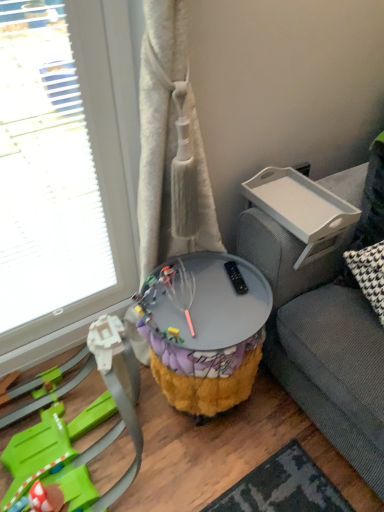
Question: Considering the relative sizes of white plastic tray at upper right, the second table ordered from the bottom, and fuzzy fabric side table at center, which is the first table from bottom to top, in the image provided, is white plastic tray at upper right, the second table ordered from the bottom, bigger than fuzzy fabric side table at center, which is the first table from bottom to top,?

Choices:
 (A) yes
 (B) no

Answer: (B)

Question: From a real-world perspective, is white plastic tray at upper right, arranged as the first table when viewed from the top, beneath fuzzy fabric side table at center, which is the first table from bottom to top?

Choices:
 (A) yes
 (B) no

Answer: (B)

Question: Is white plastic tray at upper right, arranged as the first table when viewed from the top, wider than fuzzy fabric side table at center, which is the first table from bottom to top?

Choices:
 (A) yes
 (B) no

Answer: (B)

Question: Is white plastic tray at upper right, arranged as the first table when viewed from the top, next to fuzzy fabric side table at center, which is the first table from bottom to top?

Choices:
 (A) no
 (B) yes

Answer: (A)

Question: Does white plastic tray at upper right, arranged as the first table when viewed from the top, have a lesser width compared to fuzzy fabric side table at center, acting as the 2th table starting from the top?

Choices:
 (A) no
 (B) yes

Answer: (B)

Question: Considering the relative sizes of white plastic tray at upper right, arranged as the first table when viewed from the top, and fuzzy fabric side table at center, which is the first table from bottom to top, in the image provided, is white plastic tray at upper right, arranged as the first table when viewed from the top, shorter than fuzzy fabric side table at center, which is the first table from bottom to top,?

Choices:
 (A) yes
 (B) no

Answer: (A)

Question: From a real-world perspective, is plush yellow and purple toy at lower left below white plastic tray at upper right, arranged as the first table when viewed from the top?

Choices:
 (A) no
 (B) yes

Answer: (B)

Question: Does plush yellow and purple toy at lower left have a lesser width compared to white plastic tray at upper right, arranged as the first table when viewed from the top?

Choices:
 (A) yes
 (B) no

Answer: (B)

Question: Is plush yellow and purple toy at lower left bigger than white plastic tray at upper right, the second table ordered from the bottom?

Choices:
 (A) yes
 (B) no

Answer: (A)

Question: Can you confirm if plush yellow and purple toy at lower left is shorter than white plastic tray at upper right, the second table ordered from the bottom?

Choices:
 (A) no
 (B) yes

Answer: (A)

Question: Is the position of plush yellow and purple toy at lower left more distant than that of white plastic tray at upper right, arranged as the first table when viewed from the top?

Choices:
 (A) no
 (B) yes

Answer: (A)

Question: Are plush yellow and purple toy at lower left and white plastic tray at upper right, arranged as the first table when viewed from the top, beside each other?

Choices:
 (A) yes
 (B) no

Answer: (B)

Question: Considering the relative sizes of fuzzy fabric side table at center, which is the first table from bottom to top, and plush yellow and purple toy at lower left in the image provided, is fuzzy fabric side table at center, which is the first table from bottom to top, bigger than plush yellow and purple toy at lower left?

Choices:
 (A) yes
 (B) no

Answer: (B)